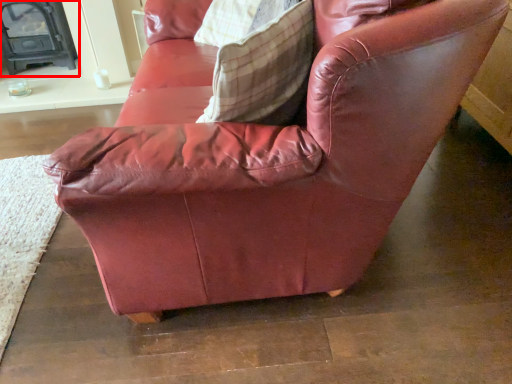
Question: Observing the image, what is the correct spatial positioning of fireplace (annotated by the red box) in reference to throw pillow?

Choices:
 (A) left
 (B) right

Answer: (A)